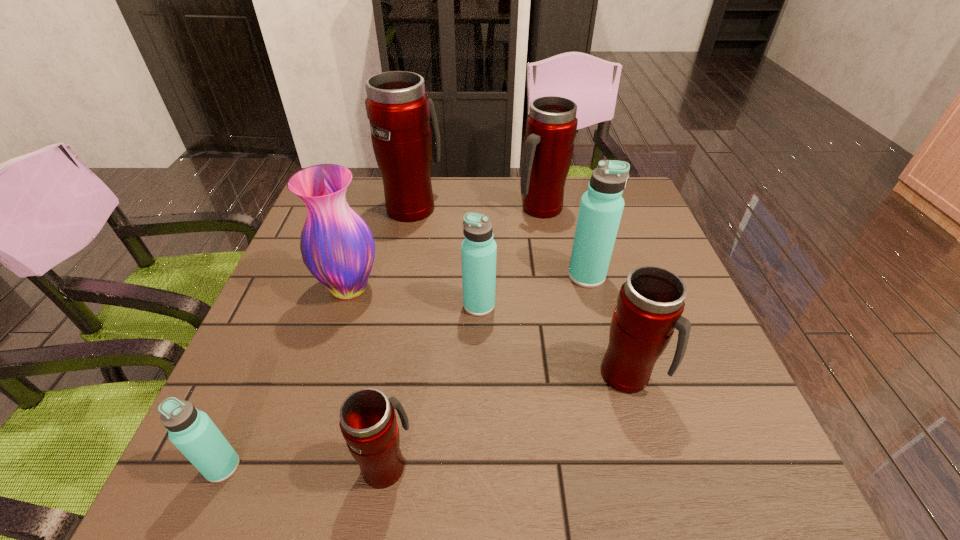
Where is `free space at the right edge`? The width and height of the screenshot is (960, 540). free space at the right edge is located at coordinates (677, 271).

Identify the location of free spot at the near right corner of the desktop. pos(669,445).

Identify the location of free point between the nearest aqua thermos bottle and the third nearest object. [425, 421].

Locate an element on the screen. This screenshot has height=540, width=960. empty space between the vase and the tallest object is located at coordinates (381, 247).

Identify the location of vacant space that is in between the biggest red thermos bottle and the fourth thermos bottle from right to left. (446, 256).

Where is `free space that is in between the biggest aqua thermos bottle and the second biggest red thermos bottle`? The width and height of the screenshot is (960, 540). free space that is in between the biggest aqua thermos bottle and the second biggest red thermos bottle is located at coordinates pos(564,242).

Locate an element on the screen. free spot between the fourth object from right to left and the smallest red thermos bottle is located at coordinates (433, 385).

Where is `vacant region between the second nearest aqua thermos bottle and the biggest red thermos bottle`? vacant region between the second nearest aqua thermos bottle and the biggest red thermos bottle is located at coordinates (446, 256).

You are a GUI agent. You are given a task and a screenshot of the screen. Output one action in this format:
    pyautogui.click(x=<x>, y=<y>)
    Task: Click on the vacant area that lies between the tallest object and the second nearest red thermos bottle
    The width and height of the screenshot is (960, 540).
    Given the screenshot: What is the action you would take?
    coord(521,291)

The width and height of the screenshot is (960, 540). Identify the location of free point between the third smallest red thermos bottle and the third biggest red thermos bottle. (585, 292).